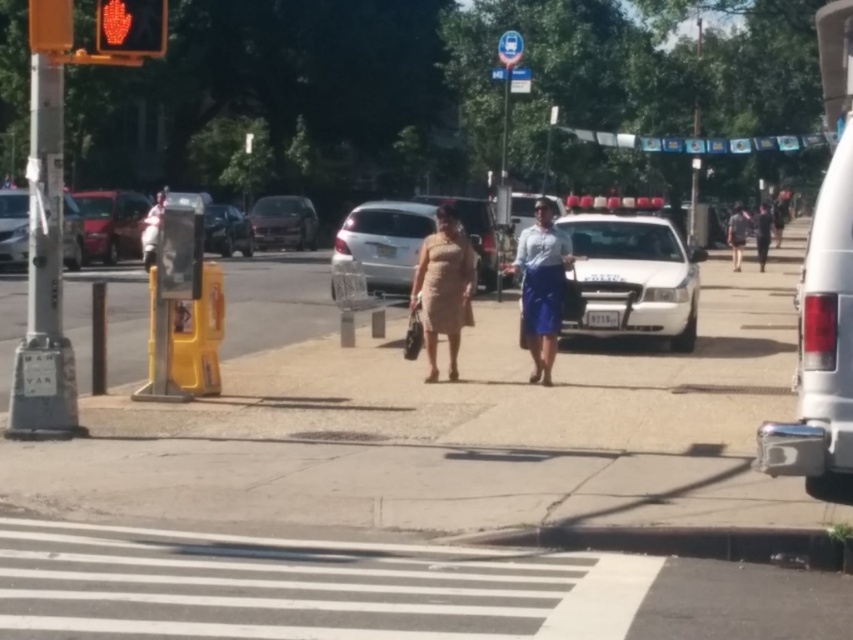
You are a pedestrian waiting at the crosswalk. There is a metallic red car at left and a shiny black sedan at center. Can you safely cross the street between them without getting too close to either vehicle?

The metallic red car at left is 3.47 meters away from the shiny black sedan at center. Since 3.47 meters is approximately 11.4 feet, there is enough space to safely cross between them without getting too close to either vehicle.

You are a pedestrian waiting at the crosswalk. You see a metallic red car at left and a shiny black sedan at center. Which car is closer to you?

The metallic red car at left is closer to you because it is larger in size compared to the shiny black sedan at center.

You are a pedestrian waiting at the crosswalk. You notice the white glossy police car at center and the matte beige dress at center. Which object is bigger in size?

The white glossy police car at center is larger in size compared to the matte beige dress at center.